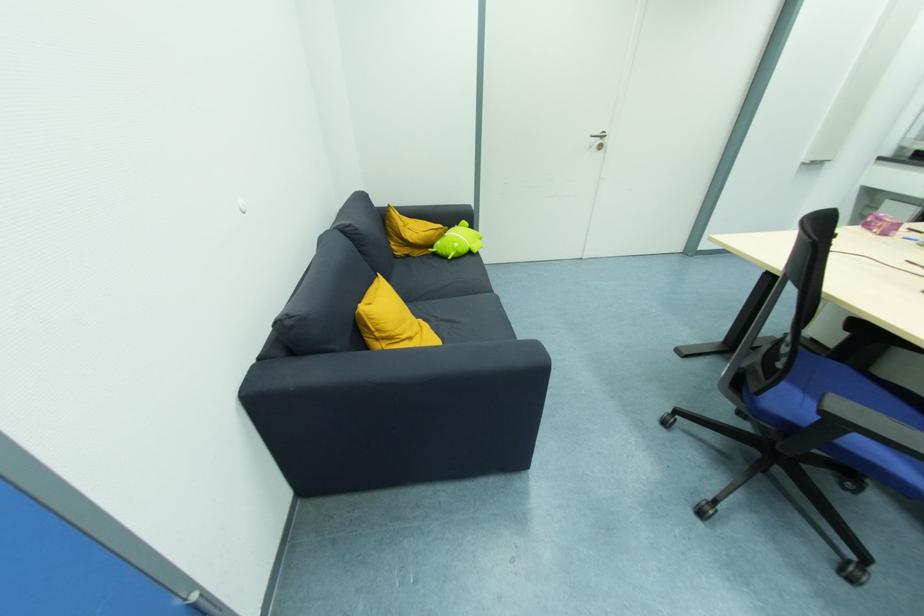
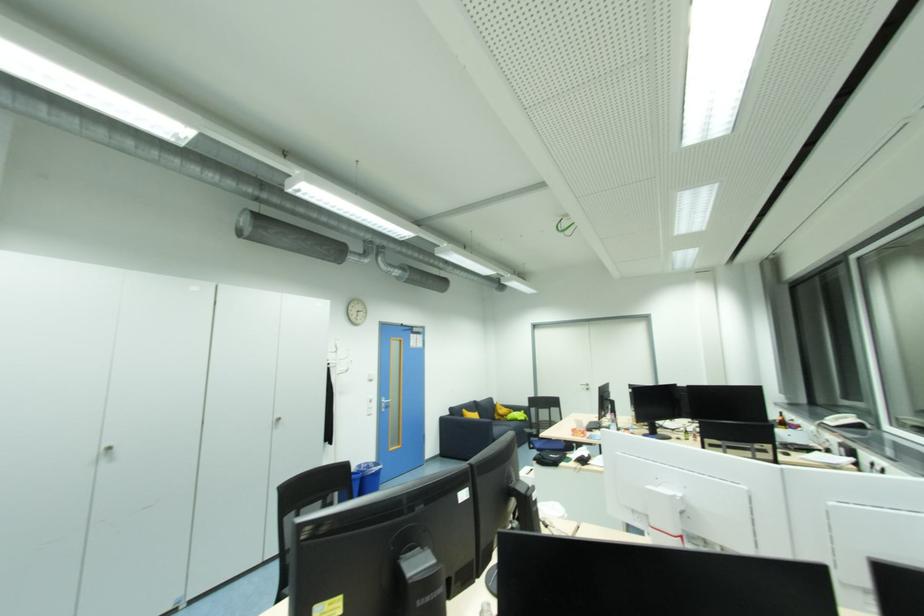
The point at (468, 224) is marked in the first image. Where is the corresponding point in the second image?

(526, 413)